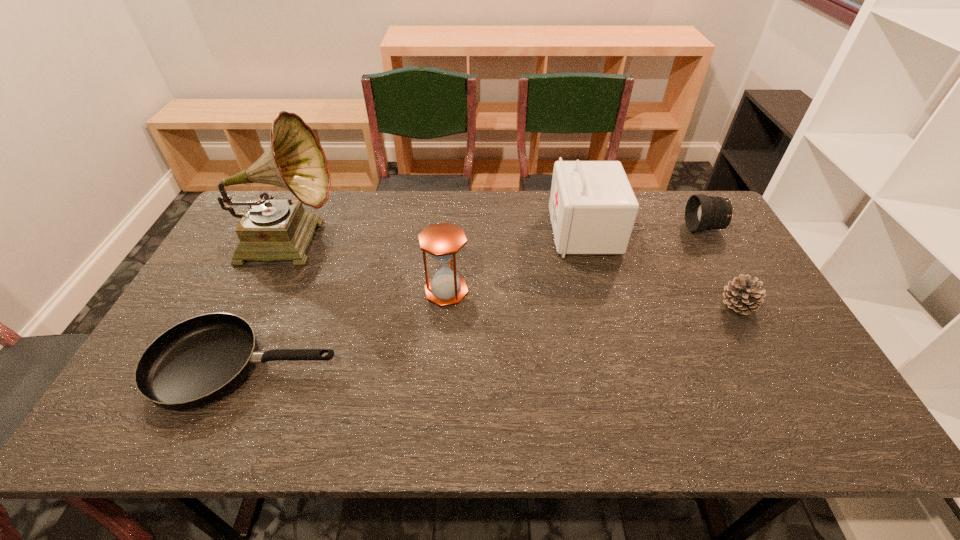
In the image, there is a desktop. Identify the location of vacant space at the far edge. (638, 234).

Locate an element on the screen. This screenshot has width=960, height=540. vacant space at the near edge is located at coordinates (739, 424).

Where is `blank space at the left edge of the desktop`? The height and width of the screenshot is (540, 960). blank space at the left edge of the desktop is located at coordinates (239, 242).

Identify the location of vacant space at the right edge. The height and width of the screenshot is (540, 960). (751, 361).

The image size is (960, 540). Find the location of `vacant space at the far left corner`. vacant space at the far left corner is located at coordinates (278, 194).

I want to click on vacant space at the near left corner, so click(157, 414).

Find the location of a particular element. vacant space at the near right corner is located at coordinates (792, 423).

You are a GUI agent. You are given a task and a screenshot of the screen. Output one action in this format:
    pyautogui.click(x=<x>, y=<y>)
    Task: Click on the free area in between the shortest object and the second shortest object
    The width and height of the screenshot is (960, 540).
    Given the screenshot: What is the action you would take?
    pyautogui.click(x=492, y=335)

At what (x,y) coordinates should I click in order to perform the action: click on free space between the telephoto lens and the tallest object. Please return your answer as a coordinate pair (x, y). The image size is (960, 540). Looking at the image, I should click on click(496, 234).

Where is `vacant space that is in between the first-aid kit and the hourglass`? This screenshot has width=960, height=540. vacant space that is in between the first-aid kit and the hourglass is located at coordinates (516, 261).